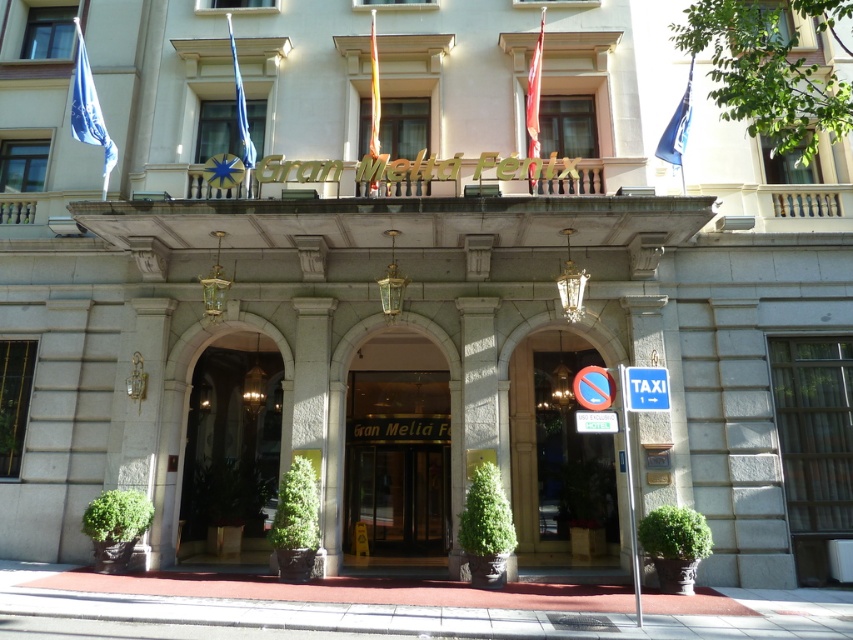
Question: Which point is farther to the camera?

Choices:
 (A) (535, 60)
 (B) (683, 136)

Answer: (A)

Question: Does red fabric flag at center have a lesser width compared to blue fabric flag at upper right?

Choices:
 (A) no
 (B) yes

Answer: (B)

Question: Can you confirm if green stone archway at center is positioned below red fabric flag at center?

Choices:
 (A) yes
 (B) no

Answer: (A)

Question: Which point is farther to the camera?

Choices:
 (A) (685, 90)
 (B) (544, 340)

Answer: (B)

Question: Among these points, which one is nearest to the camera?

Choices:
 (A) (608, 381)
 (B) (90, 96)
 (C) (473, 449)
 (D) (689, 109)

Answer: (A)

Question: Is blue fabric flag at upper left smaller than metallic circular sign at right?

Choices:
 (A) no
 (B) yes

Answer: (A)